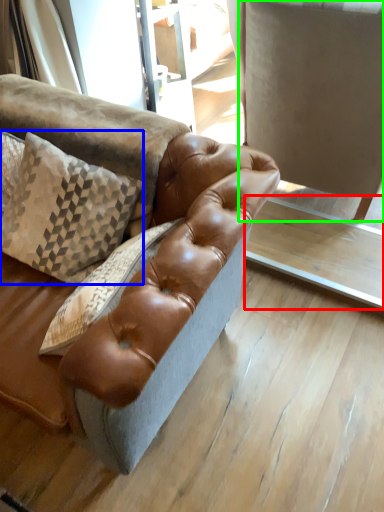
Question: Which is nearer to the table (highlighted by a red box)? pillow (highlighted by a blue box) or swivel chair (highlighted by a green box).

Choices:
 (A) pillow
 (B) swivel chair

Answer: (B)